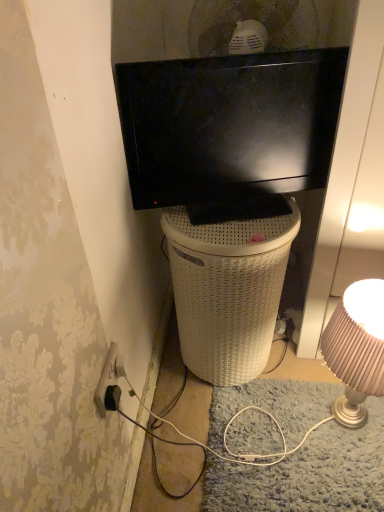
Question: Is black glossy tv at upper center to the right of matte gold lampshade at right from the viewer's perspective?

Choices:
 (A) yes
 (B) no

Answer: (B)

Question: Is black glossy tv at upper center next to matte gold lampshade at right?

Choices:
 (A) no
 (B) yes

Answer: (A)

Question: Is black glossy tv at upper center turned away from matte gold lampshade at right?

Choices:
 (A) no
 (B) yes

Answer: (A)

Question: From a real-world perspective, is black glossy tv at upper center positioned over matte gold lampshade at right based on gravity?

Choices:
 (A) yes
 (B) no

Answer: (A)

Question: Is black glossy tv at upper center further to the viewer compared to matte gold lampshade at right?

Choices:
 (A) no
 (B) yes

Answer: (A)

Question: In terms of size, does white wicker trash bin/can at center appear bigger or smaller than black glossy tv at upper center?

Choices:
 (A) small
 (B) big

Answer: (B)

Question: Looking at their shapes, would you say white wicker trash bin/can at center is wider or thinner than black glossy tv at upper center?

Choices:
 (A) wide
 (B) thin

Answer: (A)

Question: Would you say white wicker trash bin/can at center is to the left or to the right of black glossy tv at upper center in the picture?

Choices:
 (A) left
 (B) right

Answer: (A)

Question: From the image's perspective, is white wicker trash bin/can at center above or below black glossy tv at upper center?

Choices:
 (A) below
 (B) above

Answer: (A)

Question: Is matte gold lampshade at right to the left or to the right of white wicker trash bin/can at center in the image?

Choices:
 (A) left
 (B) right

Answer: (B)

Question: Considering their positions, is matte gold lampshade at right located in front of or behind white wicker trash bin/can at center?

Choices:
 (A) behind
 (B) front

Answer: (B)

Question: Is matte gold lampshade at right bigger or smaller than white wicker trash bin/can at center?

Choices:
 (A) small
 (B) big

Answer: (A)

Question: Is point (362, 325) positioned closer to the camera than point (205, 294)?

Choices:
 (A) closer
 (B) farther

Answer: (A)

Question: Which is correct: black glossy tv at upper center is inside matte gold lampshade at right, or outside of it?

Choices:
 (A) inside
 (B) outside

Answer: (B)

Question: Is black glossy tv at upper center to the left or to the right of matte gold lampshade at right in the image?

Choices:
 (A) left
 (B) right

Answer: (A)